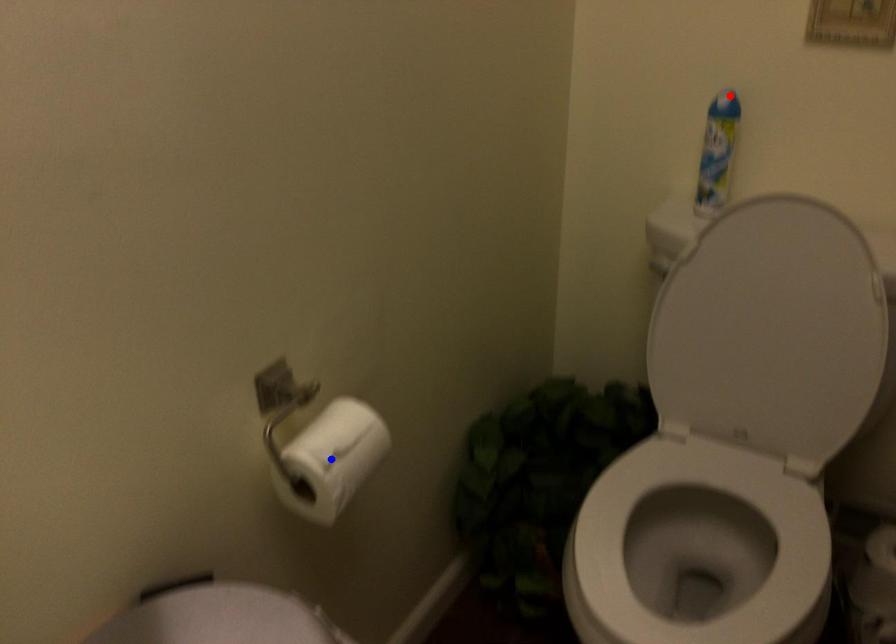
Question: Two points are marked on the image. Which point is closer to the camera?

Choices:
 (A) Blue point is closer.
 (B) Red point is closer.

Answer: (A)